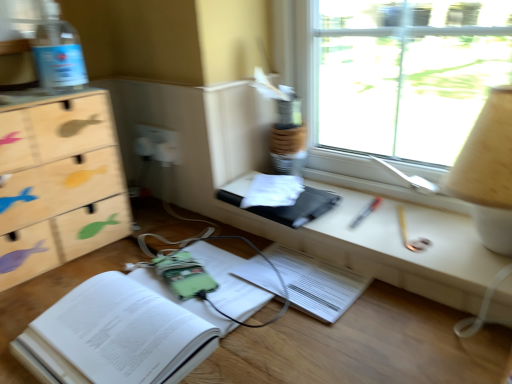
Question: Is wooden fish-patterned chest of drawers at left turned away from black matte book at center, marked as the 2th paperback book in a bottom-to-top arrangement?

Choices:
 (A) yes
 (B) no

Answer: (B)

Question: From the image's perspective, is wooden fish-patterned chest of drawers at left below black matte book at center, positioned as the 1th paperback book in top-to-bottom order?

Choices:
 (A) no
 (B) yes

Answer: (A)

Question: Is wooden fish-patterned chest of drawers at left in contact with black matte book at center, positioned as the 1th paperback book in top-to-bottom order?

Choices:
 (A) no
 (B) yes

Answer: (A)

Question: From a real-world perspective, is wooden fish-patterned chest of drawers at left located higher than black matte book at center, marked as the 2th paperback book in a bottom-to-top arrangement?

Choices:
 (A) yes
 (B) no

Answer: (A)

Question: Is wooden fish-patterned chest of drawers at left at the left side of black matte book at center, positioned as the 1th paperback book in top-to-bottom order?

Choices:
 (A) no
 (B) yes

Answer: (B)

Question: Does wooden fish-patterned chest of drawers at left have a lesser height compared to black matte book at center, positioned as the 1th paperback book in top-to-bottom order?

Choices:
 (A) yes
 (B) no

Answer: (B)

Question: Does matte black tablet at center appear on the left side of green fabric book at lower left, arranged as the 2th paperback book when viewed from the top?

Choices:
 (A) yes
 (B) no

Answer: (B)

Question: Is matte black tablet at center taller than green fabric book at lower left, positioned as the 1th paperback book in bottom-to-top order?

Choices:
 (A) no
 (B) yes

Answer: (A)

Question: From a real-world perspective, does matte black tablet at center sit lower than green fabric book at lower left, arranged as the 2th paperback book when viewed from the top?

Choices:
 (A) no
 (B) yes

Answer: (A)

Question: From the image's perspective, is matte black tablet at center under green fabric book at lower left, arranged as the 2th paperback book when viewed from the top?

Choices:
 (A) yes
 (B) no

Answer: (B)

Question: Is matte black tablet at center shorter than green fabric book at lower left, positioned as the 1th paperback book in bottom-to-top order?

Choices:
 (A) no
 (B) yes

Answer: (B)

Question: From the image's perspective, is matte black tablet at center over green fabric book at lower left, arranged as the 2th paperback book when viewed from the top?

Choices:
 (A) no
 (B) yes

Answer: (B)

Question: Considering the relative positions of green fabric book at lower left, positioned as the 1th paperback book in bottom-to-top order, and wooden fish-patterned chest of drawers at left in the image provided, is green fabric book at lower left, positioned as the 1th paperback book in bottom-to-top order, to the right of wooden fish-patterned chest of drawers at left from the viewer's perspective?

Choices:
 (A) no
 (B) yes

Answer: (B)